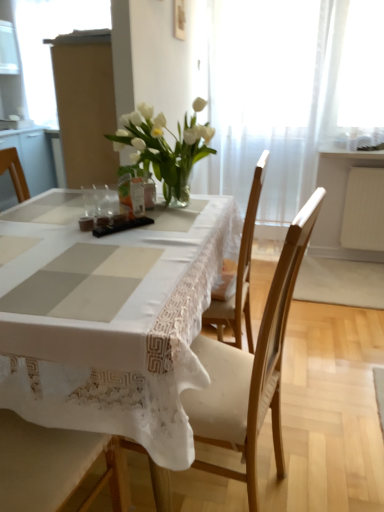
The height and width of the screenshot is (512, 384). What are the coordinates of `free space in front of white glass vase at center` in the screenshot? It's located at (155, 229).